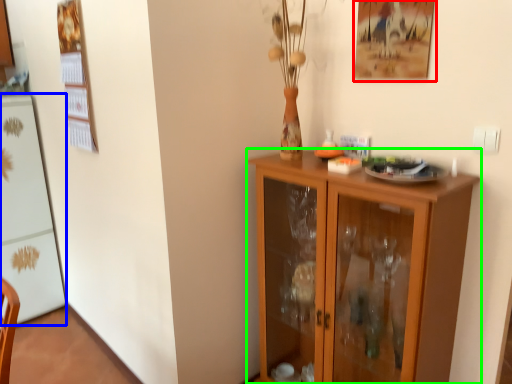
Question: Which object is the farthest from picture frame (highlighted by a red box)? Choose among these: appliance (highlighted by a blue box) or cupboard (highlighted by a green box).

Choices:
 (A) appliance
 (B) cupboard

Answer: (A)